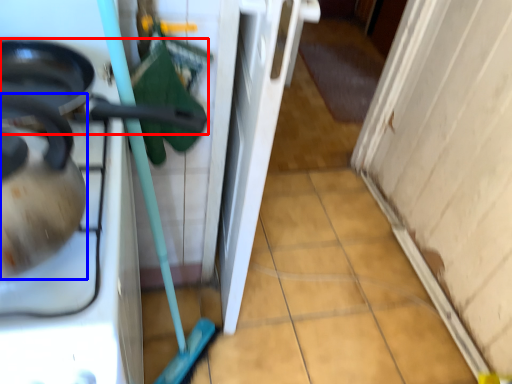
Question: Which of the following is the closest to the observer, frying pan (highlighted by a red box) or tea pot (highlighted by a blue box)?

Choices:
 (A) frying pan
 (B) tea pot

Answer: (B)